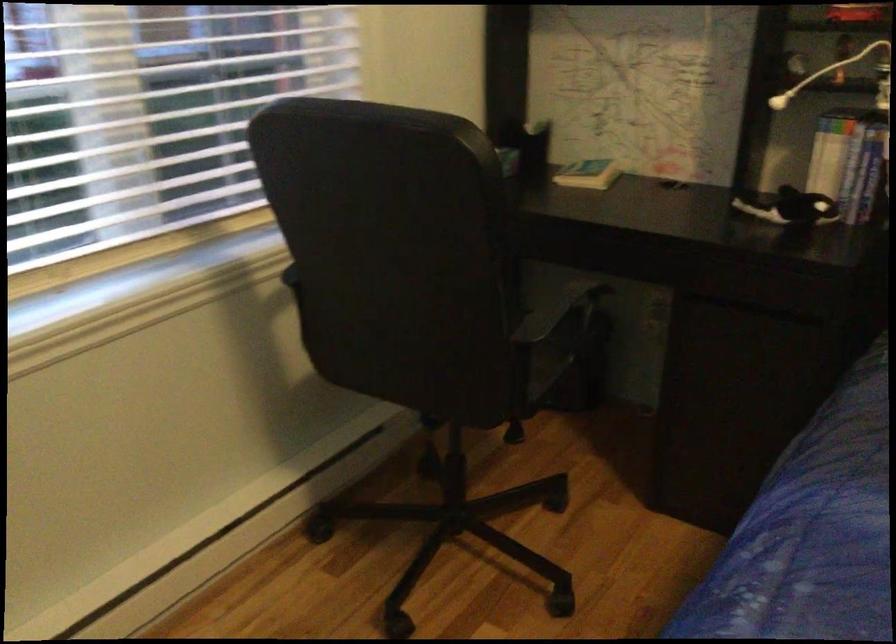
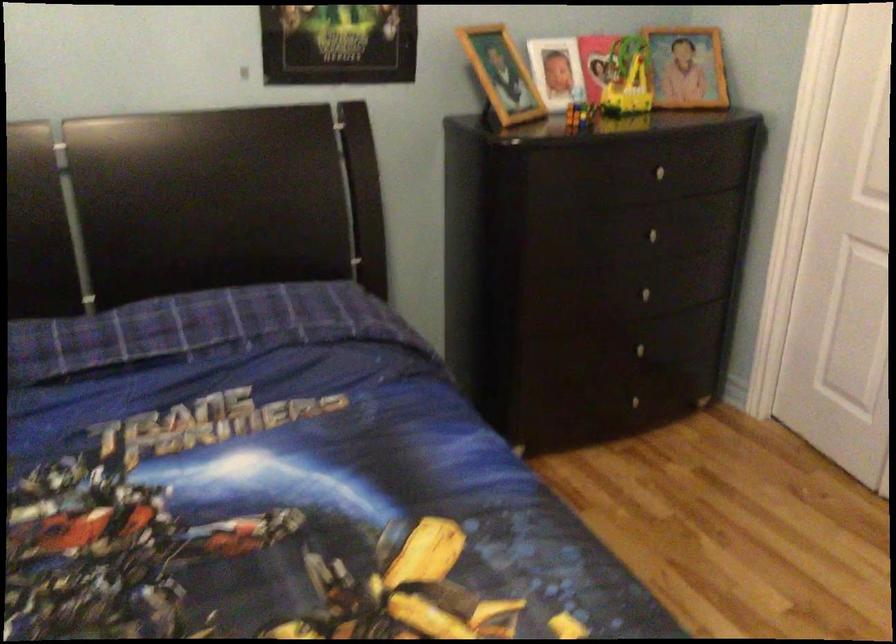
Question: The camera is either moving clockwise (left) or counter-clockwise (right) around the object. The first image is from the beginning of the video and the second image is from the end. Is the camera moving left or right when shooting the video?

Choices:
 (A) Left
 (B) Right

Answer: (A)